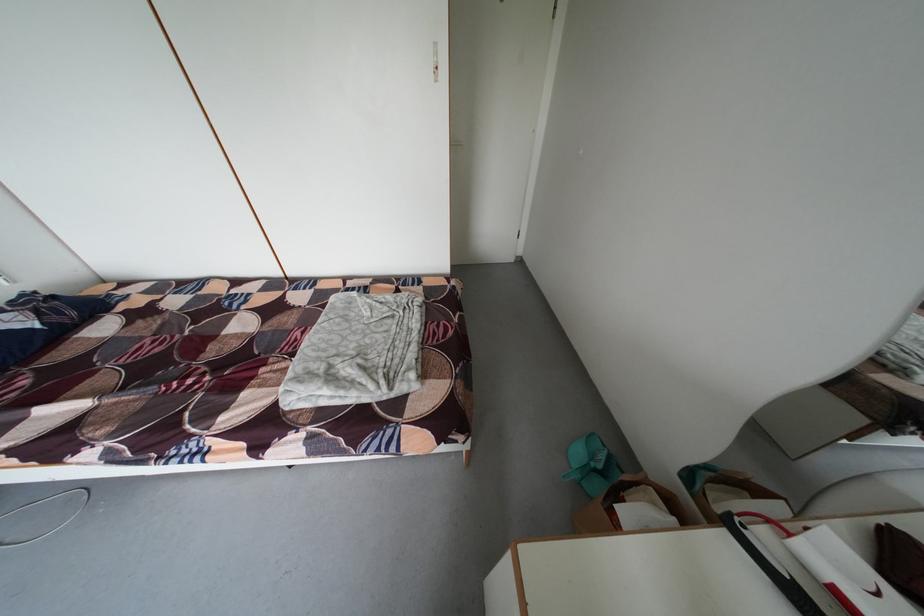
Describe the element at coordinates (767, 522) in the screenshot. I see `the red bag handle` at that location.